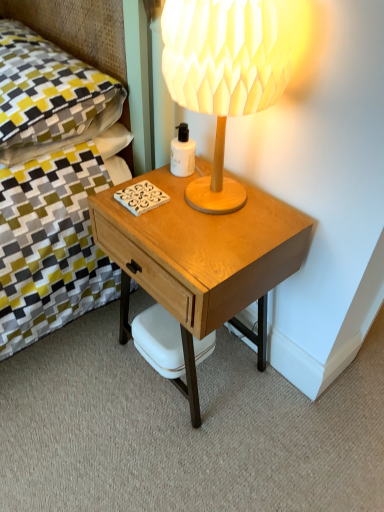
Identify the location of vacant space to the right of white matte bottle at center. pos(246,187).